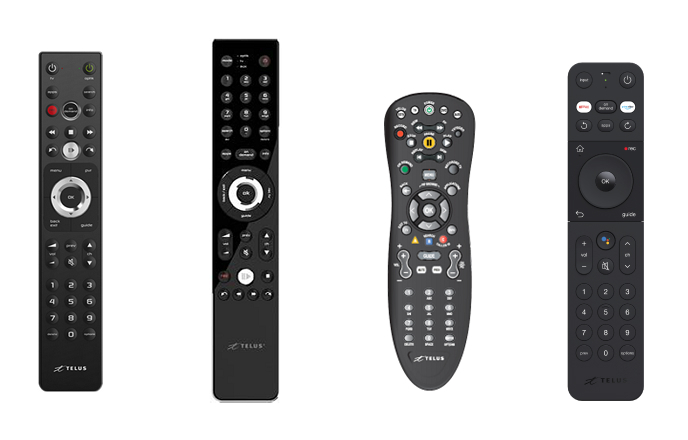
You are a GUI agent. You are given a task and a screenshot of the screen. Output one action in this format:
    pyautogui.click(x=<x>, y=<y>)
    Task: Click on the remotes
    This screenshot has width=688, height=440.
    Given the screenshot: What is the action you would take?
    pyautogui.click(x=65, y=195), pyautogui.click(x=234, y=196), pyautogui.click(x=413, y=206), pyautogui.click(x=616, y=197)